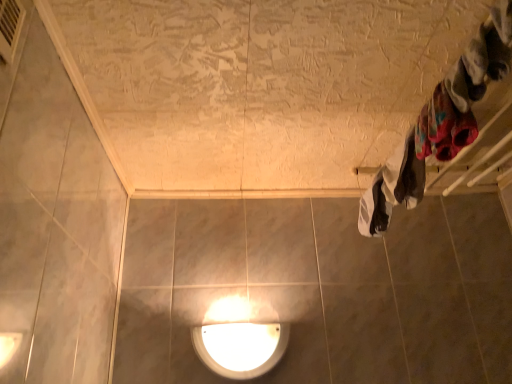
Question: Would you say white cotton towel at right, marked as the first clothing in a back-to-front arrangement, contains white glossy lamp at lower center?

Choices:
 (A) no
 (B) yes

Answer: (A)

Question: Is white cotton towel at right, placed as the 3th clothing when sorted from top to bottom, positioned behind white glossy lamp at lower center?

Choices:
 (A) yes
 (B) no

Answer: (B)

Question: Is white cotton towel at right, marked as the first clothing in a back-to-front arrangement, to the right of white glossy lamp at lower center from the viewer's perspective?

Choices:
 (A) yes
 (B) no

Answer: (A)

Question: Is white cotton towel at right, marked as the first clothing in a back-to-front arrangement, looking in the opposite direction of white glossy lamp at lower center?

Choices:
 (A) yes
 (B) no

Answer: (B)

Question: From a real-world perspective, is white cotton towel at right, placed as the 3th clothing when sorted from top to bottom, on top of white glossy lamp at lower center?

Choices:
 (A) no
 (B) yes

Answer: (B)

Question: From the image's perspective, is multicolored fabric at upper right, marked as the second clothing in a front-to-back arrangement, above or below fluffy white socks at upper right, which is the 1th clothing in top-to-bottom order?

Choices:
 (A) below
 (B) above

Answer: (A)

Question: Based on their positions, is multicolored fabric at upper right, the 2th clothing from the top, located to the left or right of fluffy white socks at upper right, which is the 3th clothing from back to front?

Choices:
 (A) left
 (B) right

Answer: (A)

Question: From a real-world perspective, relative to fluffy white socks at upper right, which is the 3th clothing in bottom-to-top order, is multicolored fabric at upper right, the 2th clothing when ordered from back to front, vertically above or below?

Choices:
 (A) above
 (B) below

Answer: (B)

Question: Is multicolored fabric at upper right, the 2th clothing when ordered from back to front, situated inside fluffy white socks at upper right, which is the 1th clothing in top-to-bottom order, or outside?

Choices:
 (A) outside
 (B) inside

Answer: (A)

Question: Would you say metallic silver air conditioner at upper left is to the left or to the right of fluffy white socks at upper right, which is the 1th clothing in top-to-bottom order, in the picture?

Choices:
 (A) left
 (B) right

Answer: (A)

Question: Is metallic silver air conditioner at upper left in front of or behind fluffy white socks at upper right, positioned as the 1th clothing in front-to-back order, in the image?

Choices:
 (A) behind
 (B) front

Answer: (B)

Question: Looking at the image, does metallic silver air conditioner at upper left seem bigger or smaller compared to fluffy white socks at upper right, positioned as the 1th clothing in front-to-back order?

Choices:
 (A) small
 (B) big

Answer: (A)

Question: From a real-world perspective, relative to fluffy white socks at upper right, positioned as the 1th clothing in front-to-back order, is metallic silver air conditioner at upper left vertically above or below?

Choices:
 (A) below
 (B) above

Answer: (B)

Question: From a real-world perspective, is metallic silver air conditioner at upper left above or below white cotton towel at right, placed as the 3th clothing when sorted from top to bottom?

Choices:
 (A) below
 (B) above

Answer: (B)

Question: Would you say metallic silver air conditioner at upper left is inside or outside white cotton towel at right, marked as the third clothing in a front-to-back arrangement?

Choices:
 (A) outside
 (B) inside

Answer: (A)